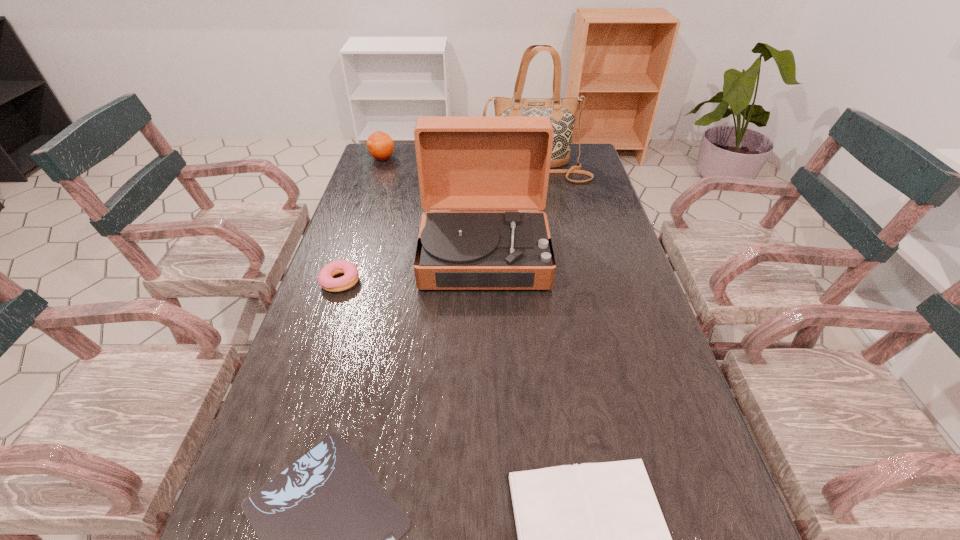
The image size is (960, 540). Identify the location of the tallest object. (x=562, y=111).

This screenshot has width=960, height=540. Find the location of `phonograph record`. phonograph record is located at coordinates (464, 162).

Where is `the third tallest object`? This screenshot has width=960, height=540. the third tallest object is located at coordinates (380, 145).

Image resolution: width=960 pixels, height=540 pixels. Find the location of `the third shortest object`. the third shortest object is located at coordinates (325, 278).

The width and height of the screenshot is (960, 540). I want to click on vacant space situated 0.130m on the front-facing side of the tallest object, so click(x=539, y=206).

The height and width of the screenshot is (540, 960). I want to click on free region located 0.280m on the face of the second tallest object, so click(x=485, y=390).

Locate an element on the screen. The height and width of the screenshot is (540, 960). free spot located on the front of the third tallest object is located at coordinates (366, 211).

Locate an element on the screen. This screenshot has height=540, width=960. free region located 0.130m on the front of the doughnut is located at coordinates (322, 335).

Where is `handbag present at the far edge`? handbag present at the far edge is located at coordinates click(x=562, y=111).

I want to click on orange that is at the far edge, so click(380, 145).